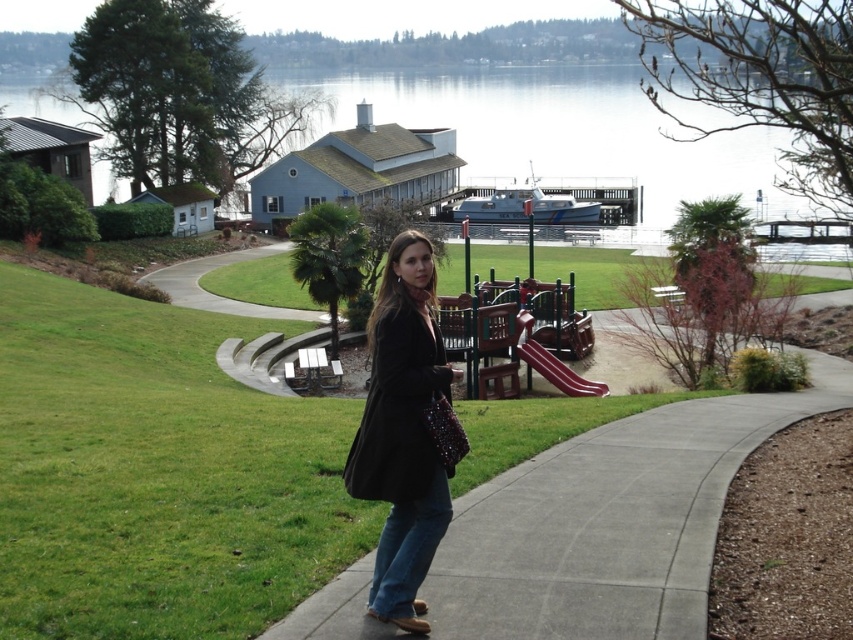
What is the exact coordinate of the black matte coat at center?

The black matte coat at center is located at point (x=403, y=432).

You are a delivery drone flying above the gray concrete sidewalk at center and the black matte coat at center. Which object is closer to the ground?

The gray concrete sidewalk at center is positioned under the black matte coat at center, so the gray concrete sidewalk at center is closer to the ground.